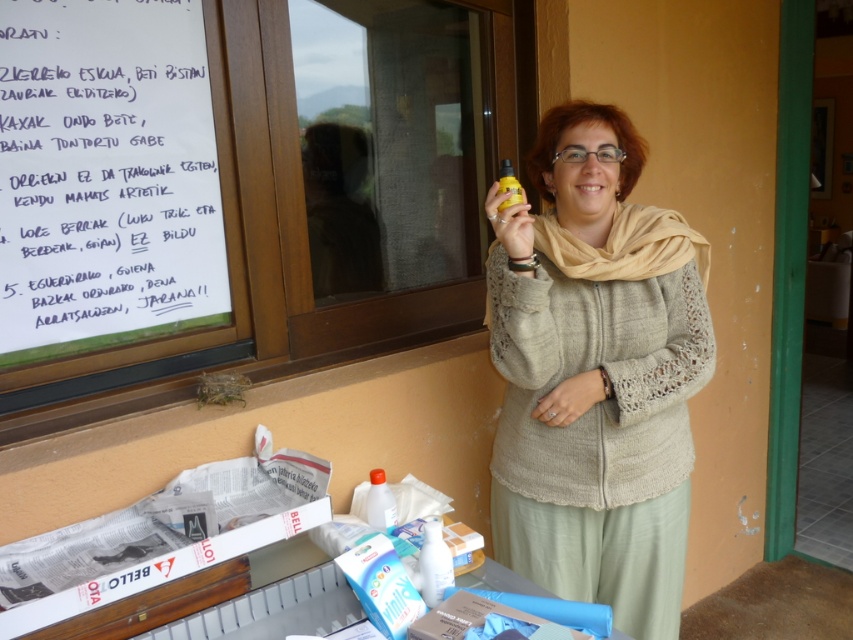
Is knitted beige sweater at center to the left of yellow matte bottle at upper center from the viewer's perspective?

Incorrect, knitted beige sweater at center is not on the left side of yellow matte bottle at upper center.

Is point (543, 406) behind point (503, 192)?

Yes, it is behind point (503, 192).

I want to click on knitted beige sweater at center, so click(x=595, y=374).

Is knitted beige sweater at center positioned behind translucent plastic bottle at lower center?

That is False.

Who is positioned more to the left, knitted beige sweater at center or translucent plastic bottle at lower center?

From the viewer's perspective, translucent plastic bottle at lower center appears more on the left side.

Is point (706, 342) positioned before point (384, 513)?

No, it is not.

This screenshot has width=853, height=640. What are the coordinates of `knitted beige sweater at center` in the screenshot? It's located at (595, 374).

Does translucent plastic bottle at lower center appear on the left side of yellow matte bottle at upper center?

Correct, you'll find translucent plastic bottle at lower center to the left of yellow matte bottle at upper center.

Is translucent plastic bottle at lower center shorter than yellow matte bottle at upper center?

Yes.

The height and width of the screenshot is (640, 853). Describe the element at coordinates (380, 502) in the screenshot. I see `translucent plastic bottle at lower center` at that location.

Find the location of a particular element. The image size is (853, 640). translucent plastic bottle at lower center is located at coordinates (380, 502).